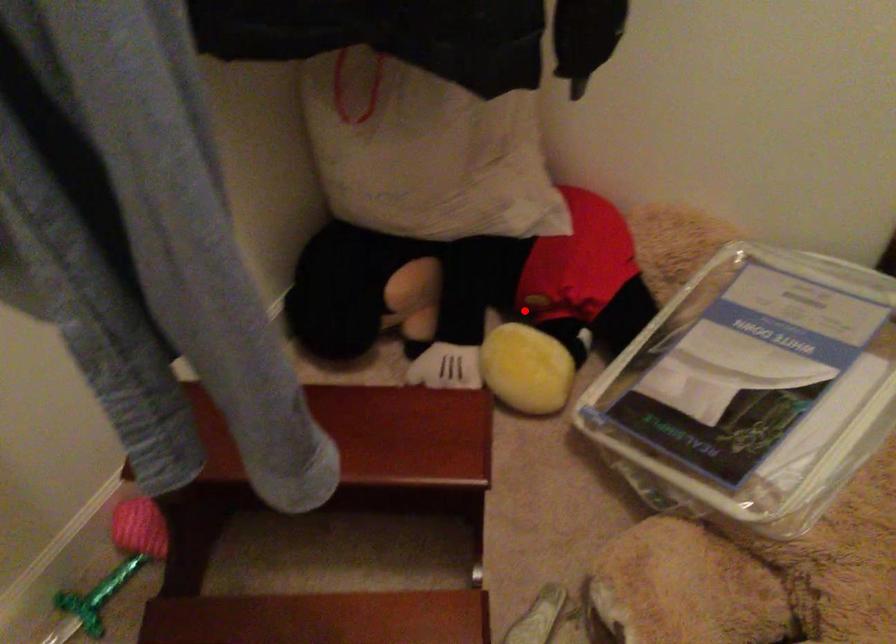
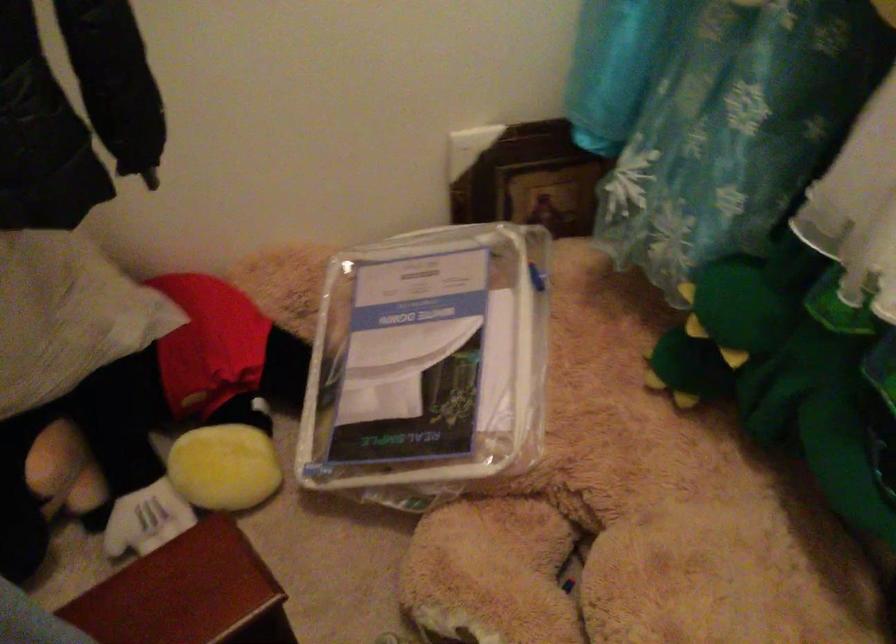
Locate, in the second image, the point that corresponds to the highlighted location in the first image.

(188, 415)